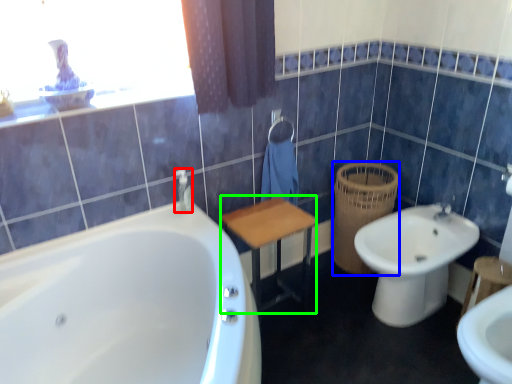
Question: Which is nearer to the toiletry (highlighted by a red box)? basket (highlighted by a blue box) or vanity (highlighted by a green box).

Choices:
 (A) basket
 (B) vanity

Answer: (B)